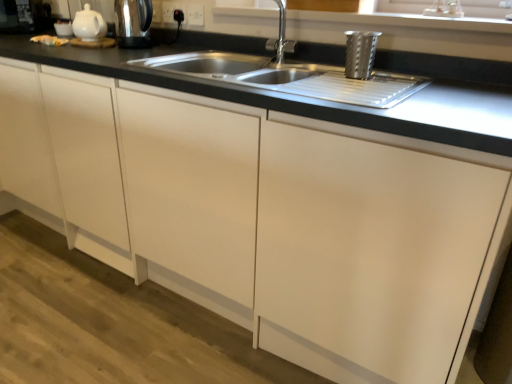
Question: Considering the positions of black plastic socket at upper center, marked as the 2th electric outlet in a right-to-left arrangement, and satin nickel faucet at upper center in the image, is black plastic socket at upper center, marked as the 2th electric outlet in a right-to-left arrangement, wider or thinner than satin nickel faucet at upper center?

Choices:
 (A) wide
 (B) thin

Answer: (B)

Question: Is black plastic socket at upper center, marked as the 2th electric outlet in a right-to-left arrangement, taller or shorter than satin nickel faucet at upper center?

Choices:
 (A) tall
 (B) short

Answer: (B)

Question: Estimate the real-world distances between objects in this image. Which object is closer to the white plastic electric outlet at upper center, which appears as the second electric outlet when viewed from the left?

Choices:
 (A) metallic stainless steel kettle at upper left, the second appliance in the bottom-to-top sequence
 (B) satin nickel faucet at upper center
 (C) white glossy teapot at upper left
 (D) black matte sink at center
 (E) black plastic socket at upper center, marked as the 2th electric outlet in a right-to-left arrangement

Answer: (E)

Question: Estimate the real-world distances between objects in this image. Which object is closer to the satin nickel faucet at upper center?

Choices:
 (A) metallic stainless steel kettle at upper left, the first appliance from the left
 (B) metallic textured cup at upper right, positioned as the first appliance in right-to-left order
 (C) white plastic electric outlet at upper center, the first electric outlet from the right
 (D) white glossy teapot at upper left
 (E) black plastic socket at upper center, marked as the first electric outlet in a left-to-right arrangement

Answer: (B)